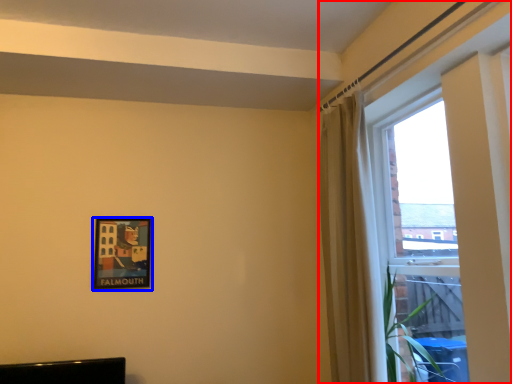
Question: Which of the following is the farthest to the observer, window (highlighted by a red box) or picture frame (highlighted by a blue box)?

Choices:
 (A) window
 (B) picture frame

Answer: (B)